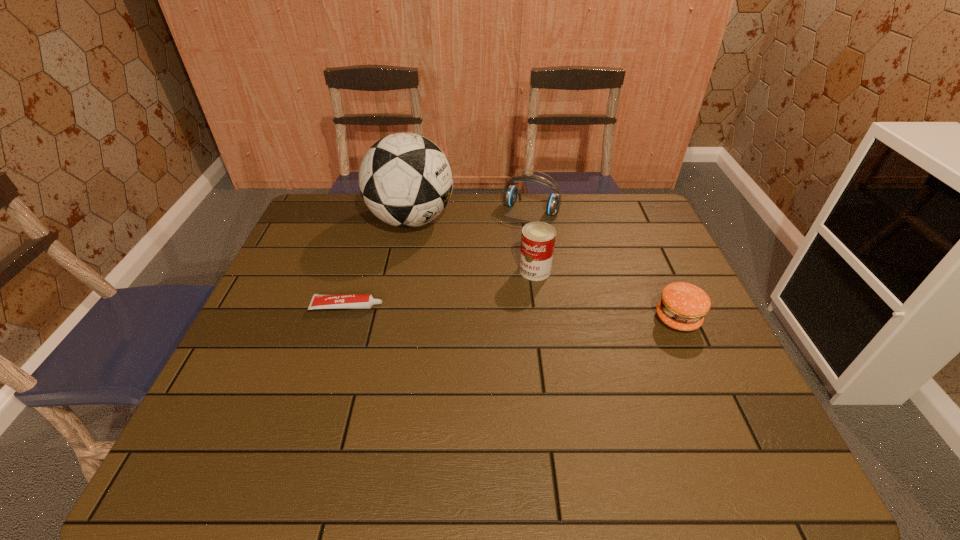
Find the location of a particular element. Image resolution: width=960 pixels, height=540 pixels. free space between the tallest object and the headset is located at coordinates (471, 214).

Locate an element on the screen. unoccupied area between the shortest object and the headset is located at coordinates (440, 258).

Where is `empty location between the tallest object and the shortest object`? The height and width of the screenshot is (540, 960). empty location between the tallest object and the shortest object is located at coordinates (379, 263).

Where is `unoccupied position between the toothpaste and the headset`? This screenshot has width=960, height=540. unoccupied position between the toothpaste and the headset is located at coordinates (440, 258).

Identify which object is the second nearest to the patty. Please provide its 2D coordinates. Your answer should be formatted as a tuple, i.e. [(x, y)], where the tuple contains the x and y coordinates of a point satisfying the conditions above.

[(510, 194)]

Image resolution: width=960 pixels, height=540 pixels. What are the coordinates of `object that ranks as the closest to the toothpaste` in the screenshot? It's located at (405, 179).

The image size is (960, 540). What are the coordinates of `vacant position in the image that satisfies the following two spatial constraints: 1. on the front side of the soccer ball; 2. on the right side of the can` in the screenshot? It's located at (401, 270).

Identify the location of free space that satisfies the following two spatial constraints: 1. on the back side of the soccer ball; 2. on the right side of the headset. The image size is (960, 540). (414, 209).

Image resolution: width=960 pixels, height=540 pixels. I want to click on blank area in the image that satisfies the following two spatial constraints: 1. on the front side of the headset; 2. on the left side of the rightmost object, so click(548, 319).